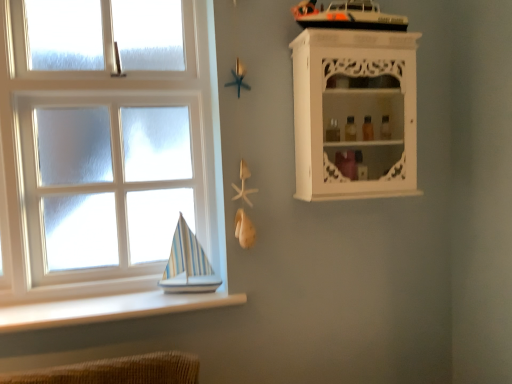
The height and width of the screenshot is (384, 512). Identify the location of white smooth ledge at lower left. (108, 308).

Between white wooden window at lower left and white carved wood cabinet at upper right, which one has less height?

white carved wood cabinet at upper right is shorter.

From the image's perspective, which object appears higher, white wooden window at lower left or white carved wood cabinet at upper right?

white carved wood cabinet at upper right appears higher in the image.

Considering the sizes of objects white wooden window at lower left and white carved wood cabinet at upper right in the image provided, who is bigger, white wooden window at lower left or white carved wood cabinet at upper right?

Bigger between the two is white wooden window at lower left.

From a real-world perspective, is white smooth ledge at lower left below white wooden window at lower left?

Correct, in the physical world, white smooth ledge at lower left is lower than white wooden window at lower left.

Considering the sizes of white smooth ledge at lower left and white wooden window at lower left in the image, is white smooth ledge at lower left taller or shorter than white wooden window at lower left?

In the image, white smooth ledge at lower left appears to be shorter than white wooden window at lower left.

In order to click on window located above the white smooth ledge at lower left (from a real-world perspective) in this screenshot , I will do `click(102, 185)`.

Does white smooth ledge at lower left have a lesser width compared to white wooden window at lower left?

In fact, white smooth ledge at lower left might be wider than white wooden window at lower left.

The height and width of the screenshot is (384, 512). Find the location of `ledge below the white carved wood cabinet at upper right (from a real-world perspective)`. ledge below the white carved wood cabinet at upper right (from a real-world perspective) is located at coordinates (108, 308).

Is white carved wood cabinet at upper right in front of or behind white smooth ledge at lower left in the image?

In the image, white carved wood cabinet at upper right appears behind white smooth ledge at lower left.

Is white smooth ledge at lower left inside white carved wood cabinet at upper right?

No, white smooth ledge at lower left is not a part of white carved wood cabinet at upper right.

Considering the positions of objects white carved wood cabinet at upper right and white smooth ledge at lower left in the image provided, who is more to the right, white carved wood cabinet at upper right or white smooth ledge at lower left?

white carved wood cabinet at upper right is more to the right.

Is white wooden window at lower left spatially inside white smooth ledge at lower left, or outside of it?

white wooden window at lower left exists outside the volume of white smooth ledge at lower left.

Does white wooden window at lower left have a greater height compared to white smooth ledge at lower left?

Correct, white wooden window at lower left is much taller as white smooth ledge at lower left.

Could you tell me if white wooden window at lower left is turned towards white smooth ledge at lower left?

Yes.

Can you tell me how much white wooden window at lower left and white smooth ledge at lower left differ in facing direction?

They differ by 0.598 degrees in their facing directions.

Which object is positioned more to the right, white smooth ledge at lower left or white carved wood cabinet at upper right?

From the viewer's perspective, white carved wood cabinet at upper right appears more on the right side.

From a real-world perspective, is white smooth ledge at lower left below white carved wood cabinet at upper right?

Indeed, from a real-world perspective, white smooth ledge at lower left is positioned beneath white carved wood cabinet at upper right.

Considering the positions of points (16, 328) and (387, 35), is point (16, 328) farther from camera compared to point (387, 35)?

No, it is in front of (387, 35).

From the image's perspective, does white smooth ledge at lower left appear higher than white carved wood cabinet at upper right?

No, from the image's perspective, white smooth ledge at lower left is not on top of white carved wood cabinet at upper right.

From a real-world perspective, is white carved wood cabinet at upper right beneath white wooden window at lower left?

No, from a real-world perspective, white carved wood cabinet at upper right is not under white wooden window at lower left.

You are a GUI agent. You are given a task and a screenshot of the screen. Output one action in this format:
    pyautogui.click(x=<x>, y=<y>)
    Task: Click on the window on the left side of white carved wood cabinet at upper right
    The height and width of the screenshot is (384, 512).
    Given the screenshot: What is the action you would take?
    pyautogui.click(x=102, y=185)

Considering their positions, is white carved wood cabinet at upper right located in front of or behind white wooden window at lower left?

In the image, white carved wood cabinet at upper right appears in front of white wooden window at lower left.

Considering the relative sizes of white carved wood cabinet at upper right and white wooden window at lower left in the image provided, is white carved wood cabinet at upper right thinner than white wooden window at lower left?

Incorrect, the width of white carved wood cabinet at upper right is not less than that of white wooden window at lower left.

Locate an element on the screen. The image size is (512, 384). shelf above the white wooden window at lower left (from the image's perspective) is located at coordinates (355, 112).

Where is `ledge below the white wooden window at lower left (from a real-world perspective)`? The image size is (512, 384). ledge below the white wooden window at lower left (from a real-world perspective) is located at coordinates (108, 308).

Looking at the image, which one is located further to white smooth ledge at lower left, white wooden window at lower left or white carved wood cabinet at upper right?

Based on the image, white carved wood cabinet at upper right appears to be further to white smooth ledge at lower left.

When comparing their distances from white carved wood cabinet at upper right, does white wooden window at lower left or white smooth ledge at lower left seem closer?

The object closer to white carved wood cabinet at upper right is white wooden window at lower left.

Considering their positions, is white carved wood cabinet at upper right positioned closer to white smooth ledge at lower left than white wooden window at lower left?

white wooden window at lower left is positioned closer to the anchor white smooth ledge at lower left.

Considering their positions, is white carved wood cabinet at upper right positioned closer to white wooden window at lower left than white smooth ledge at lower left?

Based on the image, white smooth ledge at lower left appears to be nearer to white wooden window at lower left.

Considering their positions, is white smooth ledge at lower left positioned further to white wooden window at lower left than white carved wood cabinet at upper right?

white carved wood cabinet at upper right lies further to white wooden window at lower left than the other object.

Based on their spatial positions, is white smooth ledge at lower left or white wooden window at lower left closer to white carved wood cabinet at upper right?

Based on the image, white wooden window at lower left appears to be nearer to white carved wood cabinet at upper right.

Where is `ledge between white wooden window at lower left and white carved wood cabinet at upper right`? ledge between white wooden window at lower left and white carved wood cabinet at upper right is located at coordinates (108, 308).